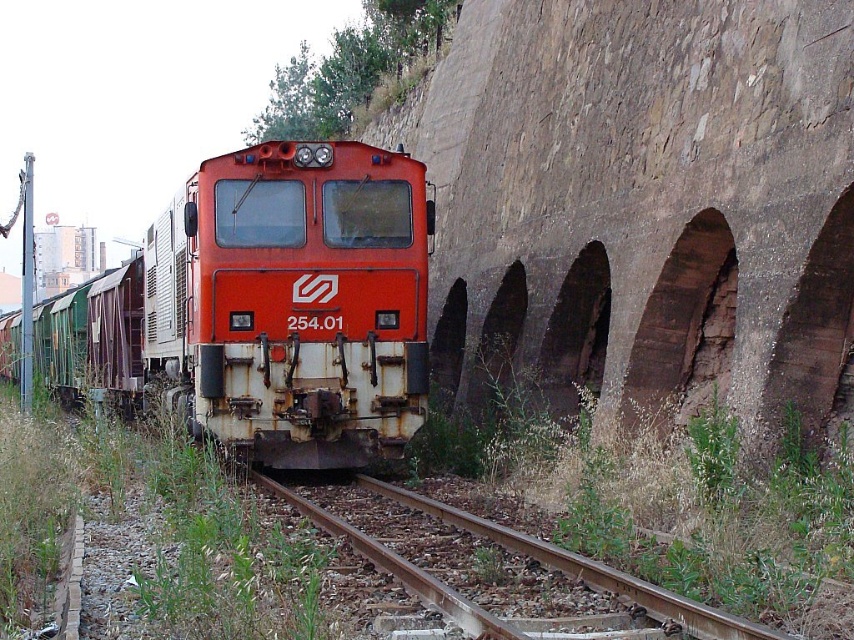
You are a railway inspector checking the clearance between the rusty metal train at center and the brown gravel train track at center. Based on the provided information, is the train wider than the track?

The rusty metal train at center might be wider than brown gravel train track at center, so there could be a clearance issue that needs further inspection.

Looking at this image, you are a maintenance worker inspecting the railway. You notice the rusty metal train at center and the brown gravel train track at center. Which object is closer to your current position?

The rusty metal train at center is closer to your current position because it is further to the viewer than the brown gravel train track at center.

You are standing on the platform and see the rusty metal train at center and the brown gravel train track at center. Which object is positioned to the left?

The rusty metal train at center is positioned to the left of the brown gravel train track at center.